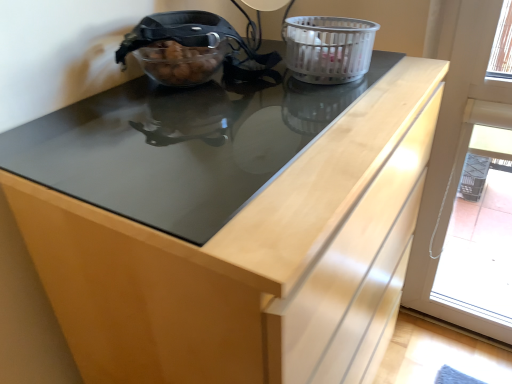
Question: Does translucent plastic basket at upper right touch transparent plastic screen door at right?

Choices:
 (A) no
 (B) yes

Answer: (A)

Question: Is translucent plastic basket at upper right oriented towards transparent plastic screen door at right?

Choices:
 (A) yes
 (B) no

Answer: (B)

Question: Considering the relative sizes of translucent plastic basket at upper right and transparent plastic screen door at right in the image provided, is translucent plastic basket at upper right smaller than transparent plastic screen door at right?

Choices:
 (A) yes
 (B) no

Answer: (A)

Question: Does translucent plastic basket at upper right contain transparent plastic screen door at right?

Choices:
 (A) no
 (B) yes

Answer: (A)

Question: Are translucent plastic basket at upper right and transparent plastic screen door at right located far from each other?

Choices:
 (A) yes
 (B) no

Answer: (B)

Question: Is translucent plastic basket at upper right wider than transparent plastic screen door at right?

Choices:
 (A) yes
 (B) no

Answer: (A)

Question: From a real-world perspective, is transparent plastic screen door at right below translucent plastic basket at upper right?

Choices:
 (A) no
 (B) yes

Answer: (B)

Question: Does transparent plastic screen door at right lie in front of translucent plastic basket at upper right?

Choices:
 (A) no
 (B) yes

Answer: (A)

Question: From the image's perspective, is transparent plastic screen door at right on top of translucent plastic basket at upper right?

Choices:
 (A) yes
 (B) no

Answer: (B)

Question: From a real-world perspective, does transparent plastic screen door at right stand above translucent plastic basket at upper right?

Choices:
 (A) yes
 (B) no

Answer: (B)

Question: Is transparent plastic screen door at right outside of translucent plastic basket at upper right?

Choices:
 (A) no
 (B) yes

Answer: (B)

Question: Does transparent plastic screen door at right have a smaller size compared to translucent plastic basket at upper right?

Choices:
 (A) no
 (B) yes

Answer: (A)

Question: Is point (503, 157) closer or farther from the camera than point (343, 31)?

Choices:
 (A) closer
 (B) farther

Answer: (B)